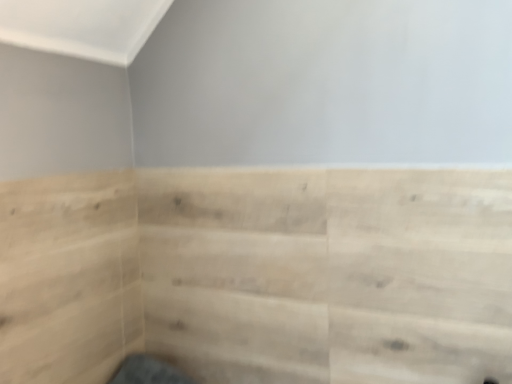
Question: Should I look upward or downward to see light wood paneling at center?

Choices:
 (A) up
 (B) down

Answer: (B)